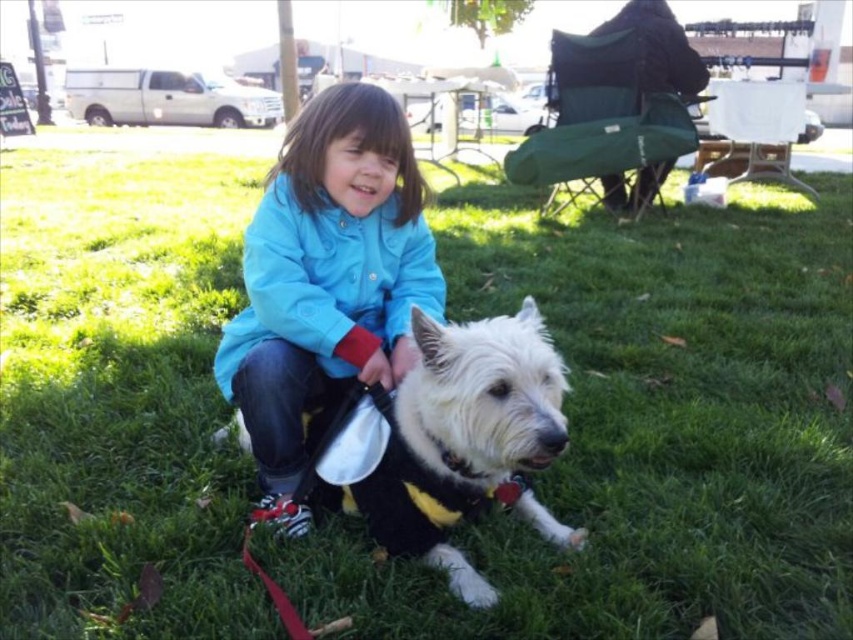
Question: Can you confirm if blue fabric jacket at center is wider than white fluffy dog at center?

Choices:
 (A) yes
 (B) no

Answer: (B)

Question: Is blue fabric jacket at center positioned at the back of white fluffy dog at center?

Choices:
 (A) no
 (B) yes

Answer: (B)

Question: Does blue fabric jacket at center appear on the left side of white fluffy dog at center?

Choices:
 (A) yes
 (B) no

Answer: (A)